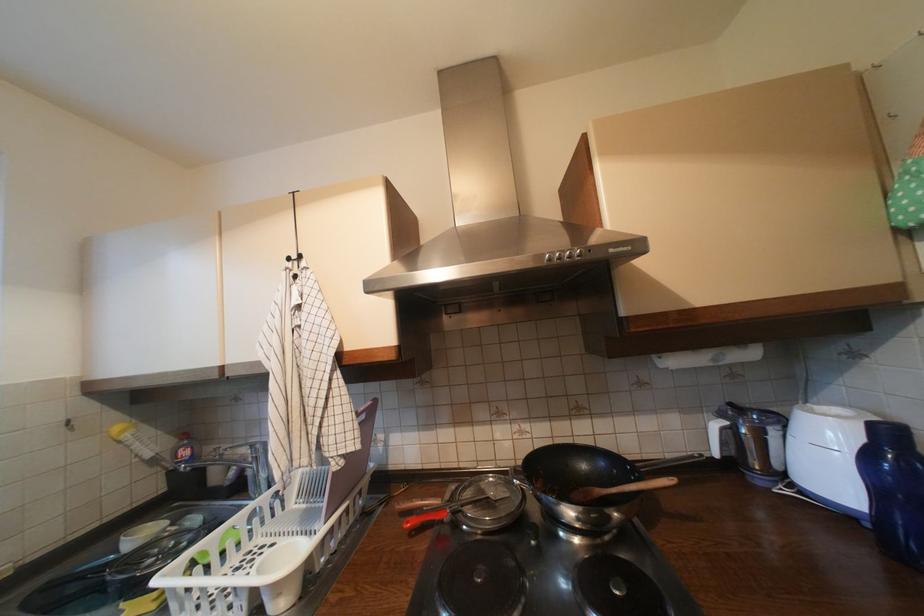
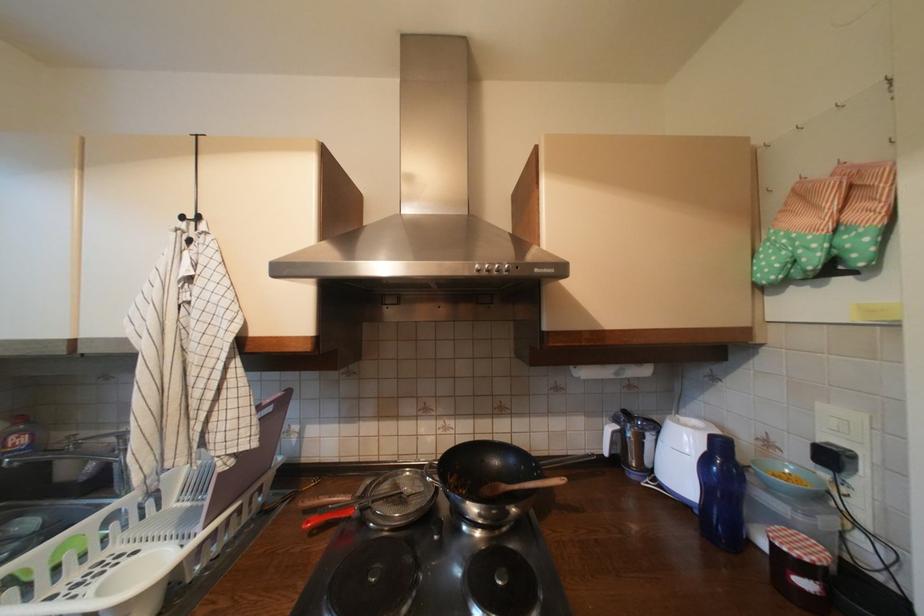
Locate, in the second image, the point that corresponds to (x=417, y=524) in the first image.

(317, 524)